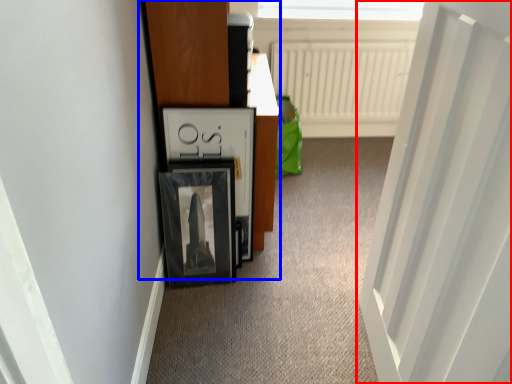
Question: Which object is further to the camera taking this photo, door (highlighted by a red box) or dresser (highlighted by a blue box)?

Choices:
 (A) door
 (B) dresser

Answer: (B)